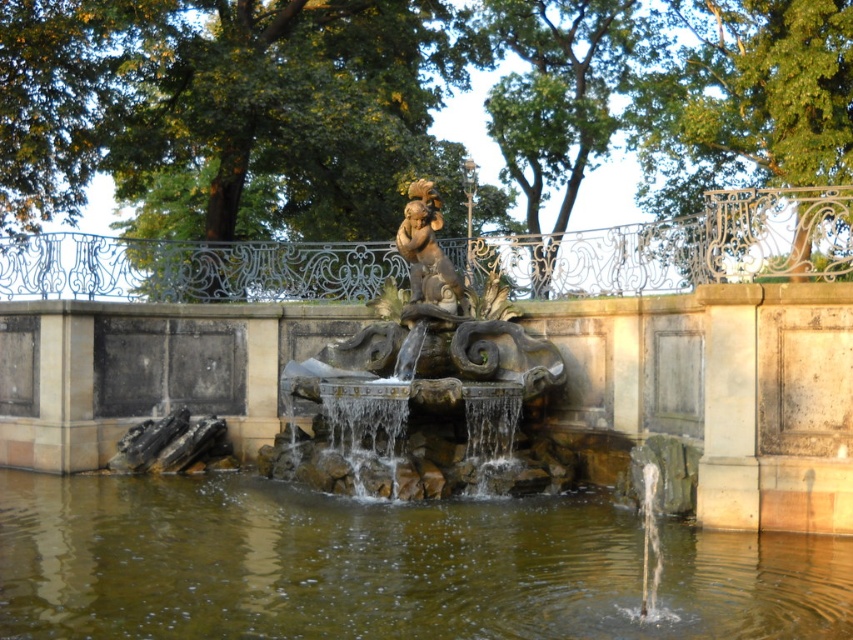
In the scene shown: You are standing in front of the classical fountain in the park. You notice a point marked at coordinates (386, 566). Which object from the scene is located at this point?

The point at coordinates (386, 566) indicates the brown stone water at center.

You are a visitor at the park and want to take a photo of the brown stone water at center and the stone fountain at center. Which one is shorter?

The brown stone water at center is shorter than the stone fountain at center.